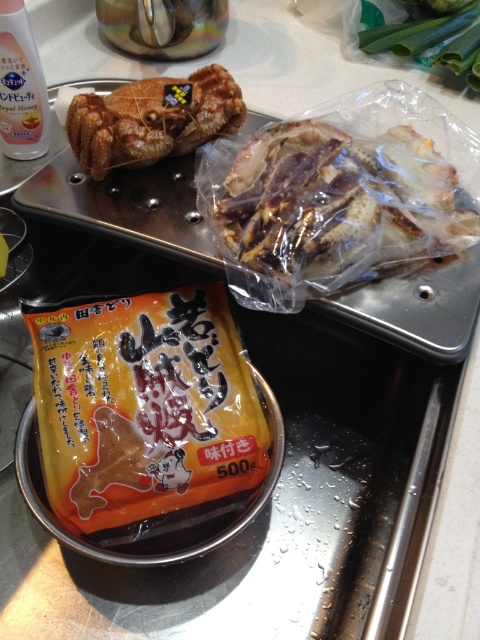
Is translucent plastic chicken at upper right further to camera compared to brown crispy crab at upper left?

No, translucent plastic chicken at upper right is in front of brown crispy crab at upper left.

Who is more distant from viewer, (397,186) or (115,168)?

The point (115,168) is behind.

Identify the location of translucent plastic chicken at upper right. (337, 205).

Is orange matte bag at center below translucent plastic chicken at upper right?

Correct, orange matte bag at center is located below translucent plastic chicken at upper right.

Between orange matte bag at center and translucent plastic chicken at upper right, which one is positioned higher?

translucent plastic chicken at upper right is higher up.

Is point (87, 348) less distant than point (277, 230)?

No.

Find the location of `orange matte bag at center`. orange matte bag at center is located at coordinates (144, 406).

Does orange matte bag at center have a smaller size compared to brown crispy crab at upper left?

Incorrect, orange matte bag at center is not smaller in size than brown crispy crab at upper left.

Is orange matte bag at center positioned in front of brown crispy crab at upper left?

Yes, orange matte bag at center is in front of brown crispy crab at upper left.

Find the location of a particular element. orange matte bag at center is located at coordinates (144, 406).